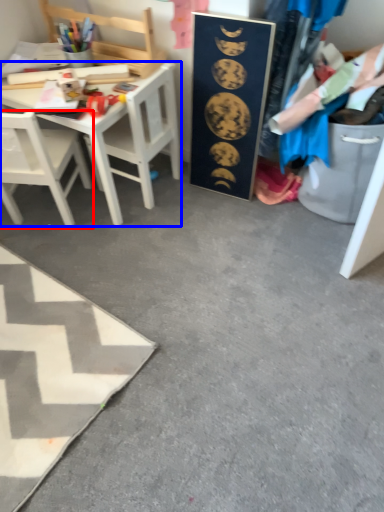
Question: Among these objects, which one is nearest to the camera, chair (highlighted by a red box) or desk (highlighted by a blue box)?

Choices:
 (A) chair
 (B) desk

Answer: (A)